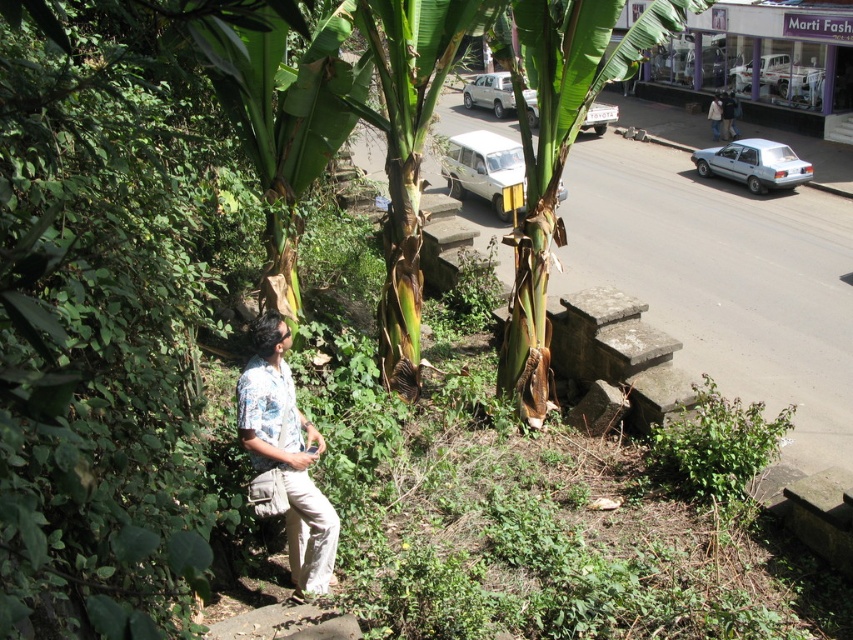
Consider the image. You are standing at the point marked as point (556,148). What object is located exactly at this point?

The green leafy banana tree at center is located exactly at point (556,148).

You are a photographer trying to capture a wide shot of the green leafy banana tree at center and the floral shirt at lower left. Which object is wider so that it can fill more of the frame?

The green leafy banana tree at center is wider than the floral shirt at lower left, so it will fill more of the frame.